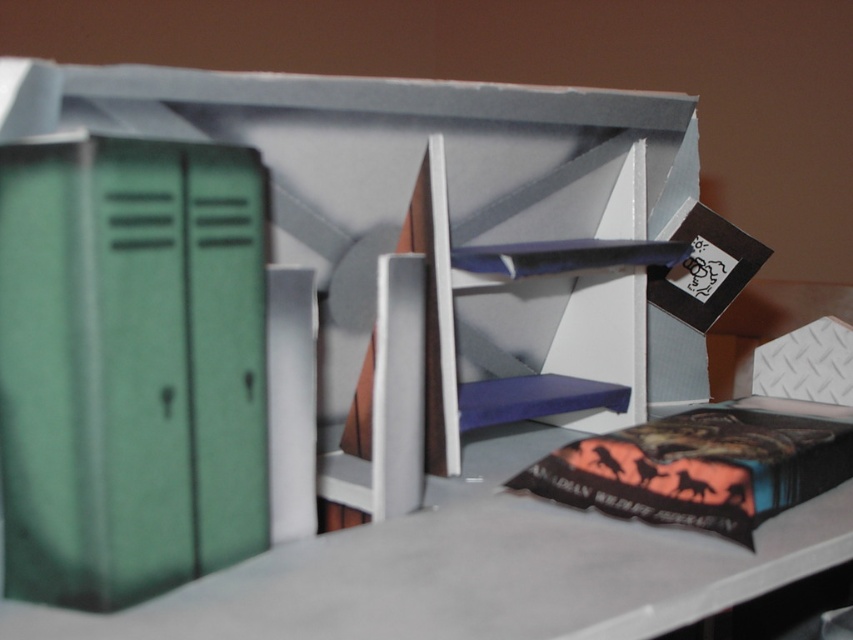
Is the position of green matte locker at left more distant than that of orange matte book at lower right?

No, it is in front of orange matte book at lower right.

Consider the image. Does green matte locker at left have a lesser height compared to orange matte book at lower right?

In fact, green matte locker at left may be taller than orange matte book at lower right.

Is point (84, 237) less distant than point (572, 499)?

Yes, point (84, 237) is closer to viewer.

Find the location of `green matte locker at left`. green matte locker at left is located at coordinates (131, 365).

Which is more to the left, matte black book at center or orange matte book at lower right?

matte black book at center

In the scene shown: Does matte black book at center lie in front of orange matte book at lower right?

Yes, it is.

Is point (227, 385) positioned behind point (688, 483)?

No, it is not.

Find the location of a particular element. Image resolution: width=853 pixels, height=640 pixels. matte black book at center is located at coordinates (296, 301).

Does matte black book at center appear on the left side of green matte locker at left?

Incorrect, matte black book at center is not on the left side of green matte locker at left.

In the scene shown: Is matte black book at center smaller than green matte locker at left?

Incorrect, matte black book at center is not smaller in size than green matte locker at left.

Who is more distant from viewer, (111, 161) or (62, 492)?

Positioned behind is point (62, 492).

This screenshot has height=640, width=853. Identify the location of matte black book at center. (296, 301).